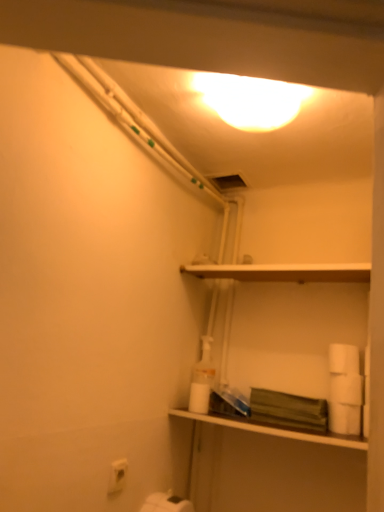
Question: Does white matte toilet paper at lower right, acting as the 1th toilet paper starting from the right, touch white matte toilet paper at right, the fourth toilet paper positioned from the left?

Choices:
 (A) no
 (B) yes

Answer: (B)

Question: From the image's perspective, is white matte toilet paper at lower right, which is the 5th toilet paper in left-to-right order, over white matte toilet paper at right, the fourth toilet paper positioned from the left?

Choices:
 (A) no
 (B) yes

Answer: (B)

Question: Is white matte toilet paper at lower right, acting as the 1th toilet paper starting from the right, further to camera compared to white matte toilet paper at right, the fourth toilet paper positioned from the left?

Choices:
 (A) yes
 (B) no

Answer: (A)

Question: From a real-world perspective, is white matte toilet paper at lower right, which is the 5th toilet paper in left-to-right order, located beneath white matte toilet paper at right, the fourth toilet paper positioned from the left?

Choices:
 (A) no
 (B) yes

Answer: (A)

Question: Is white matte toilet paper at lower right, which is the 5th toilet paper in left-to-right order, oriented towards white matte toilet paper at right, the fourth toilet paper positioned from the left?

Choices:
 (A) yes
 (B) no

Answer: (B)

Question: Is white matte toilet paper at lower right, placed as the third toilet paper when sorted from left to right, wider or thinner than white matte shelf at upper center, the second shelf in the bottom-to-top sequence?

Choices:
 (A) thin
 (B) wide

Answer: (A)

Question: From the image's perspective, relative to white matte shelf at upper center, marked as the first shelf in a top-to-bottom arrangement, is white matte toilet paper at lower right, placed as the third toilet paper when sorted from left to right, above or below?

Choices:
 (A) below
 (B) above

Answer: (A)

Question: Looking at the image, does white matte toilet paper at lower right, the 3th toilet paper viewed from the right, seem bigger or smaller compared to white matte shelf at upper center, marked as the first shelf in a top-to-bottom arrangement?

Choices:
 (A) small
 (B) big

Answer: (A)

Question: Is white matte toilet paper at lower right, the 3th toilet paper viewed from the right, inside or outside of white matte shelf at upper center, marked as the first shelf in a top-to-bottom arrangement?

Choices:
 (A) inside
 (B) outside

Answer: (B)

Question: From a real-world perspective, relative to translucent plastic bottle at center, is white matte toilet paper at lower right, which is the 5th toilet paper in left-to-right order, vertically above or below?

Choices:
 (A) below
 (B) above

Answer: (B)

Question: Considering the positions of white matte toilet paper at lower right, which is the 5th toilet paper in left-to-right order, and translucent plastic bottle at center in the image, is white matte toilet paper at lower right, which is the 5th toilet paper in left-to-right order, taller or shorter than translucent plastic bottle at center?

Choices:
 (A) tall
 (B) short

Answer: (B)

Question: Would you say white matte toilet paper at lower right, acting as the 1th toilet paper starting from the right, is to the left or to the right of translucent plastic bottle at center in the picture?

Choices:
 (A) right
 (B) left

Answer: (A)

Question: Considering the positions of white matte toilet paper at lower right, acting as the 1th toilet paper starting from the right, and translucent plastic bottle at center in the image, is white matte toilet paper at lower right, acting as the 1th toilet paper starting from the right, wider or thinner than translucent plastic bottle at center?

Choices:
 (A) thin
 (B) wide

Answer: (B)

Question: From the image's perspective, relative to white matte toilet paper at lower right, placed as the third toilet paper when sorted from left to right, is white matte shelf at upper center, the second shelf in the bottom-to-top sequence, above or below?

Choices:
 (A) below
 (B) above

Answer: (B)

Question: In terms of size, does white matte shelf at upper center, the second shelf in the bottom-to-top sequence, appear bigger or smaller than white matte toilet paper at lower right, placed as the third toilet paper when sorted from left to right?

Choices:
 (A) big
 (B) small

Answer: (A)